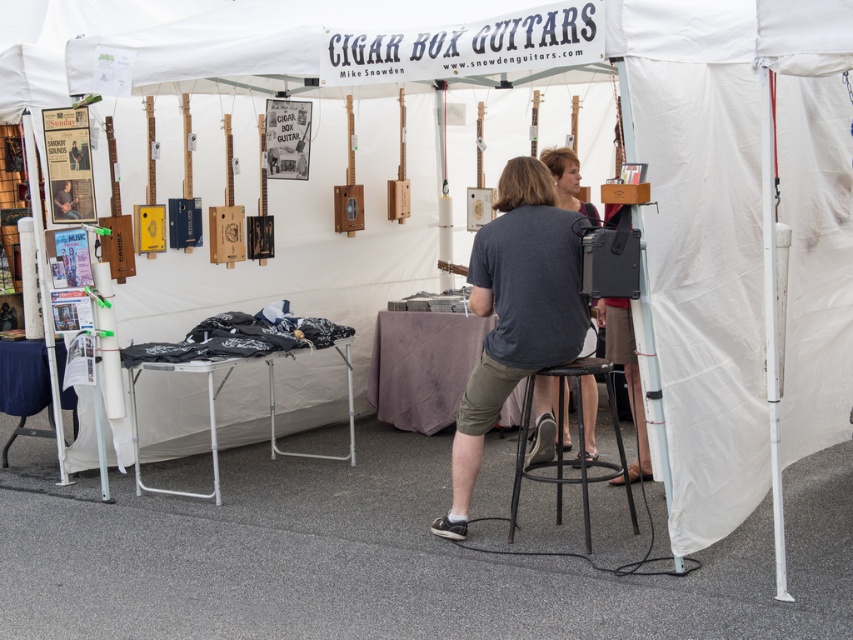
Can you confirm if black metal bar stool at lower center is smaller than metallic silver table at center?

No, black metal bar stool at lower center is not smaller than metallic silver table at center.

Can you confirm if black metal bar stool at lower center is thinner than metallic silver table at center?

Yes, black metal bar stool at lower center is thinner than metallic silver table at center.

What do you see at coordinates (578, 444) in the screenshot? This screenshot has width=853, height=640. I see `black metal bar stool at lower center` at bounding box center [578, 444].

Image resolution: width=853 pixels, height=640 pixels. I want to click on black metal bar stool at lower center, so click(578, 444).

Which is behind, point (579, 467) or point (564, 182)?

The point (564, 182) is more distant.

Who is more forward, (619, 458) or (589, 417)?

Point (619, 458) is more forward.

Find the location of a particular element. black metal bar stool at lower center is located at coordinates (578, 444).

This screenshot has height=640, width=853. What do you see at coordinates (515, 312) in the screenshot? I see `dark gray t-shirt at center` at bounding box center [515, 312].

From the picture: Who is more forward, (x=538, y=225) or (x=584, y=416)?

Point (x=538, y=225) is in front.

You are a GUI agent. You are given a task and a screenshot of the screen. Output one action in this format:
    pyautogui.click(x=<x>, y=<y>)
    Task: Click on the dark gray t-shirt at center
    The height and width of the screenshot is (640, 853).
    Given the screenshot: What is the action you would take?
    pyautogui.click(x=515, y=312)